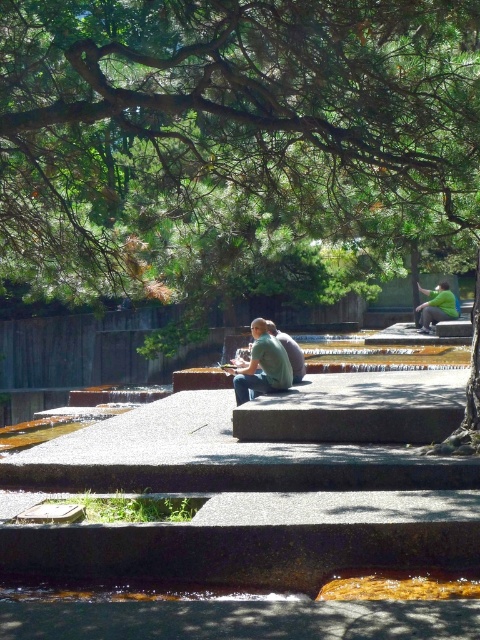
Is green cotton shirt at center thinner than green matte shirt at center?

Indeed, green cotton shirt at center has a lesser width compared to green matte shirt at center.

Is green cotton shirt at center bigger than green matte shirt at center?

Actually, green cotton shirt at center might be smaller than green matte shirt at center.

Measure the distance between point (x=266, y=333) and camera.

A distance of 45.63 feet exists between point (x=266, y=333) and camera.

Identify the location of green cotton shirt at center. (262, 365).

Which is above, green leafy tree at upper center or green cotton shirt at center?

green leafy tree at upper center

How distant is green leafy tree at upper center from green cotton shirt at center?

A distance of 7.44 meters exists between green leafy tree at upper center and green cotton shirt at center.

Describe the element at coordinates (228, 131) in the screenshot. I see `green leafy tree at upper center` at that location.

I want to click on green leafy tree at upper center, so click(228, 131).

Between point (128, 154) and point (422, 301), which one is positioned in front?

Point (128, 154)

Identify the location of green leafy tree at upper center. Image resolution: width=480 pixels, height=640 pixels. (228, 131).